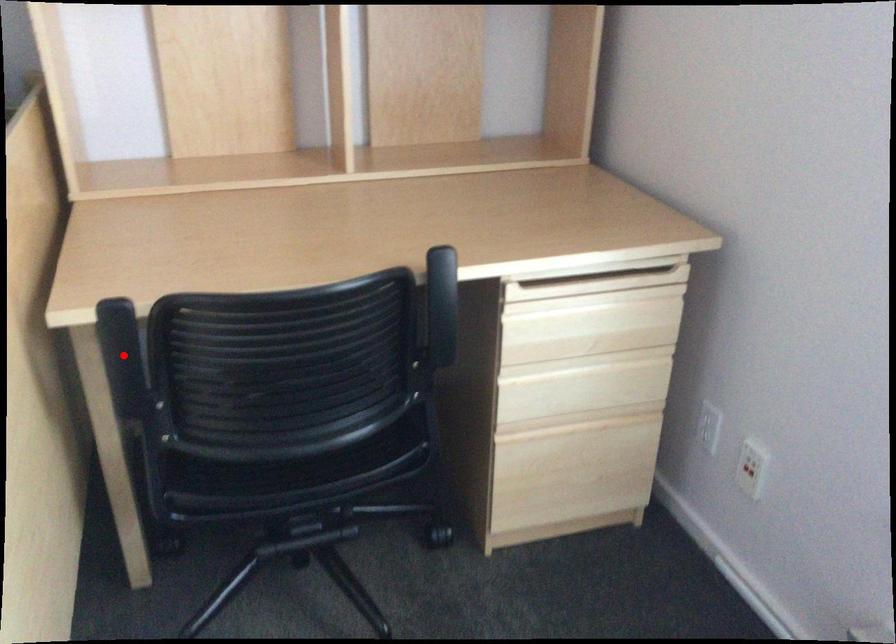
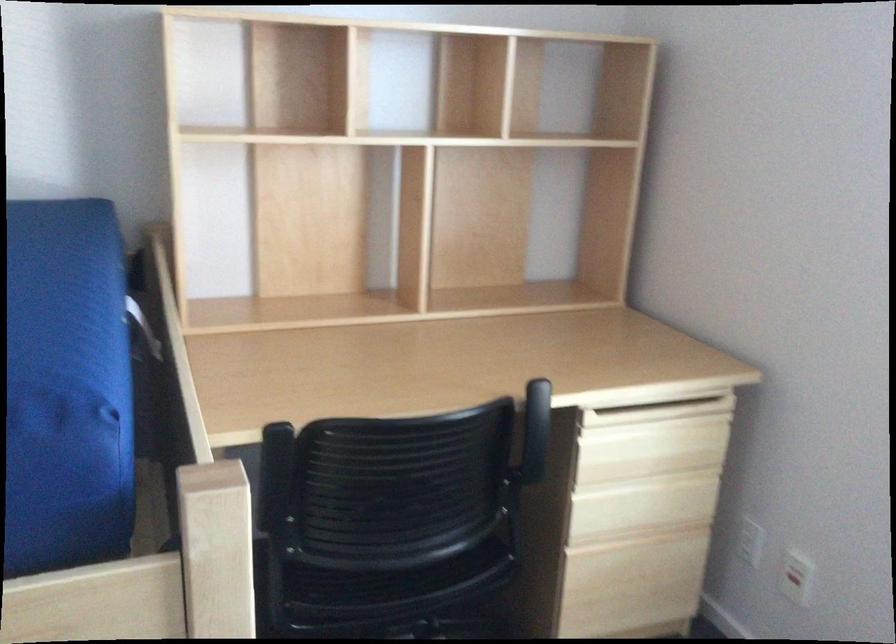
Question: I am providing you with two images of the same scene from different viewpoints. Given a red point in image1, look at the same physical point in image2. Is it:

Choices:
 (A) Closer to the viewpoint
 (B) Farther from the viewpoint

Answer: (B)